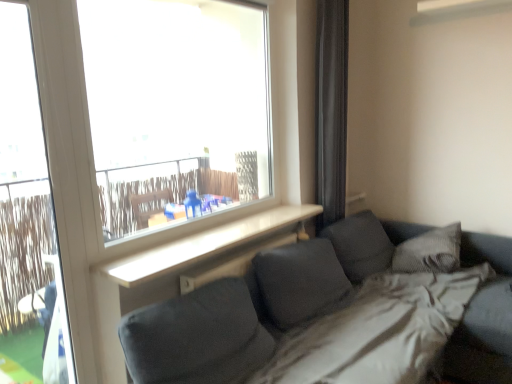
Question: Is white plastic screen door at left behind black fabric curtain at right?

Choices:
 (A) yes
 (B) no

Answer: (B)

Question: Is white plastic screen door at left facing away from black fabric curtain at right?

Choices:
 (A) no
 (B) yes

Answer: (A)

Question: From the image's perspective, does white plastic screen door at left appear higher than black fabric curtain at right?

Choices:
 (A) yes
 (B) no

Answer: (B)

Question: Considering the relative sizes of white plastic screen door at left and black fabric curtain at right in the image provided, is white plastic screen door at left shorter than black fabric curtain at right?

Choices:
 (A) no
 (B) yes

Answer: (A)

Question: Does white plastic screen door at left contain black fabric curtain at right?

Choices:
 (A) yes
 (B) no

Answer: (B)

Question: Based on their positions, is black fabric curtain at right located to the left or right of white plastic screen door at left?

Choices:
 (A) left
 (B) right

Answer: (B)

Question: Considering their positions, is black fabric curtain at right located in front of or behind white plastic screen door at left?

Choices:
 (A) behind
 (B) front

Answer: (A)

Question: Is point (330, 208) closer or farther from the camera than point (47, 160)?

Choices:
 (A) closer
 (B) farther

Answer: (B)

Question: From a real-world perspective, relative to white plastic screen door at left, is black fabric curtain at right vertically above or below?

Choices:
 (A) below
 (B) above

Answer: (B)

Question: From the image's perspective, relative to black fabric curtain at right, is textured gray pillow at right above or below?

Choices:
 (A) above
 (B) below

Answer: (B)

Question: Looking at the image, does textured gray pillow at right seem bigger or smaller compared to black fabric curtain at right?

Choices:
 (A) big
 (B) small

Answer: (B)

Question: Is textured gray pillow at right spatially inside black fabric curtain at right, or outside of it?

Choices:
 (A) outside
 (B) inside

Answer: (A)

Question: Does point (457, 246) appear closer or farther from the camera than point (323, 115)?

Choices:
 (A) farther
 (B) closer

Answer: (B)

Question: From the image's perspective, is white plastic screen door at left above or below black fabric curtain at right?

Choices:
 (A) above
 (B) below

Answer: (B)

Question: Considering the relative positions of white plastic screen door at left and black fabric curtain at right in the image provided, is white plastic screen door at left to the left or to the right of black fabric curtain at right?

Choices:
 (A) left
 (B) right

Answer: (A)